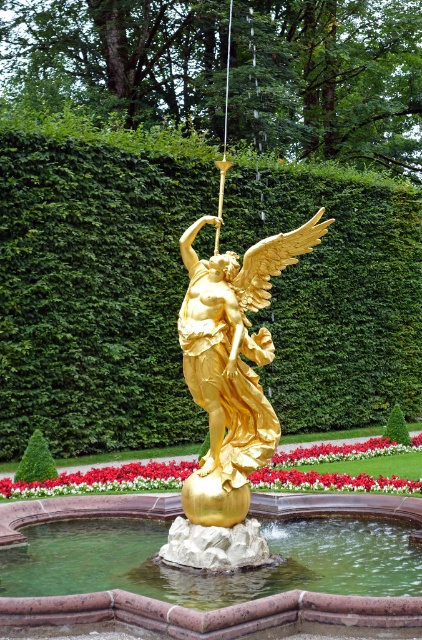
Question: Estimate the real-world distances between objects in this image. Which object is closer to the gold polished statue at center?

Choices:
 (A) green leafy hedge at center
 (B) red glossy flower at center

Answer: (B)

Question: Which point is closer to the camera?

Choices:
 (A) gold polished statue at center
 (B) green leafy hedge at center
 (C) red glossy flower at center

Answer: (A)

Question: Does gold polished sphere at center have a larger size compared to red glossy flower at center?

Choices:
 (A) yes
 (B) no

Answer: (B)

Question: Is green leafy hedge at center smaller than red glossy flower at center?

Choices:
 (A) yes
 (B) no

Answer: (B)

Question: Is gold polished sphere at center in front of gold polished statue at center?

Choices:
 (A) no
 (B) yes

Answer: (B)

Question: Which point is closer to the camera?

Choices:
 (A) gold polished statue at center
 (B) gold polished sphere at center

Answer: (B)